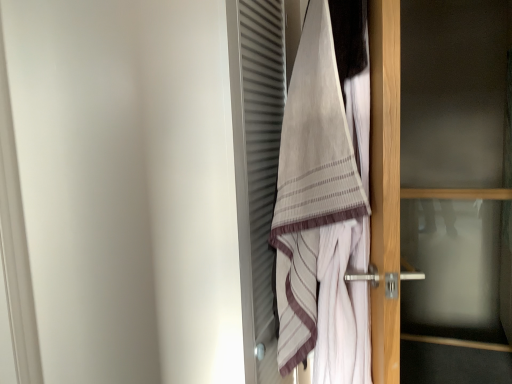
Question: Is beige striped towel at center in front of or behind transparent glass door at right in the image?

Choices:
 (A) behind
 (B) front

Answer: (B)

Question: Considering the positions of beige striped towel at center and transparent glass door at right in the image, is beige striped towel at center taller or shorter than transparent glass door at right?

Choices:
 (A) tall
 (B) short

Answer: (B)

Question: Would you say beige striped towel at center is inside or outside transparent glass door at right?

Choices:
 (A) inside
 (B) outside

Answer: (B)

Question: Is transparent glass door at right inside the boundaries of beige striped towel at center, or outside?

Choices:
 (A) inside
 (B) outside

Answer: (B)

Question: Looking at their shapes, would you say transparent glass door at right is wider or thinner than beige striped towel at center?

Choices:
 (A) wide
 (B) thin

Answer: (B)

Question: From their relative heights in the image, would you say transparent glass door at right is taller or shorter than beige striped towel at center?

Choices:
 (A) tall
 (B) short

Answer: (A)

Question: From the image's perspective, is transparent glass door at right located above or below beige striped towel at center?

Choices:
 (A) above
 (B) below

Answer: (B)